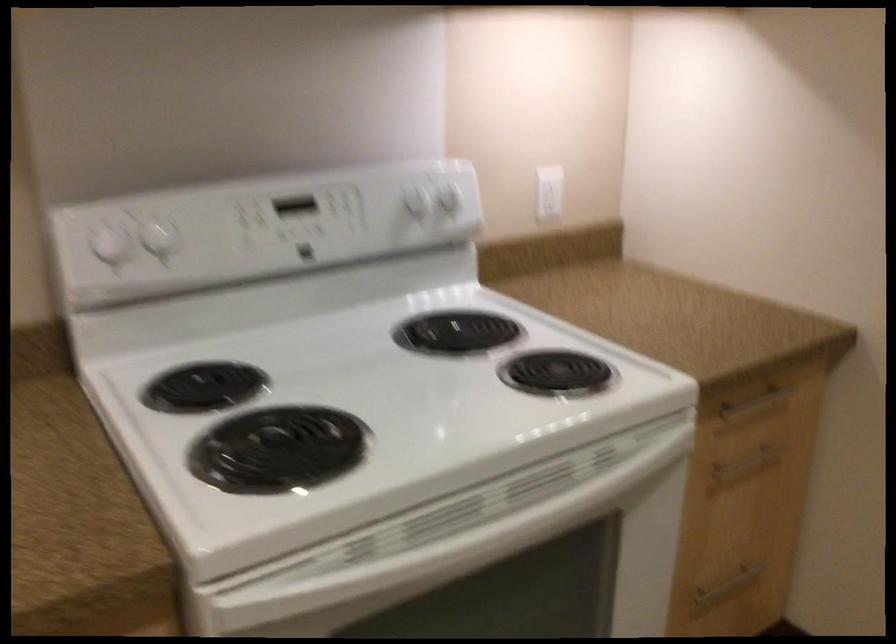
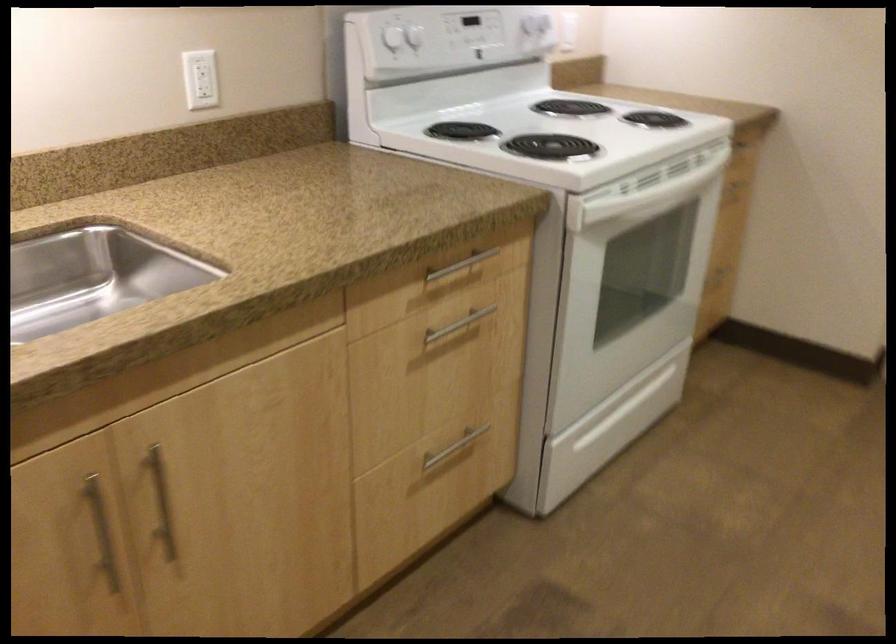
Where in the second image is the point corresponding to (122,239) from the first image?

(392, 38)